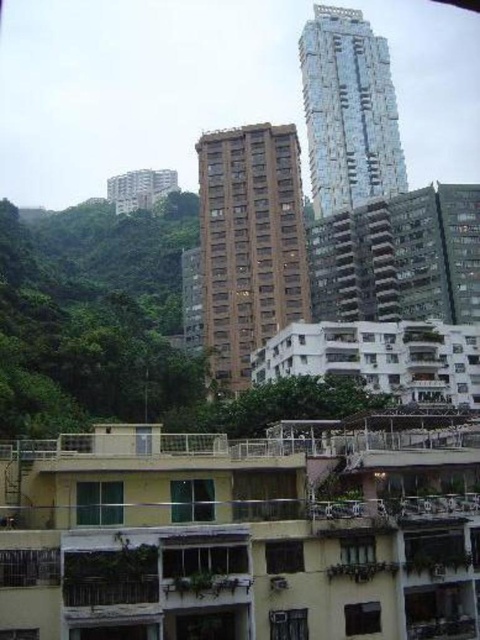
Can you confirm if brown textured building at center is positioned above glassy reflective building at upper center?

Incorrect, brown textured building at center is not positioned above glassy reflective building at upper center.

In the scene shown: Which is above, brown textured building at center or glassy reflective building at upper center?

glassy reflective building at upper center

Between point (284, 189) and point (328, 93), which one is positioned behind?

Point (328, 93)

Locate an element on the screen. This screenshot has width=480, height=640. brown textured building at center is located at coordinates (250, 243).